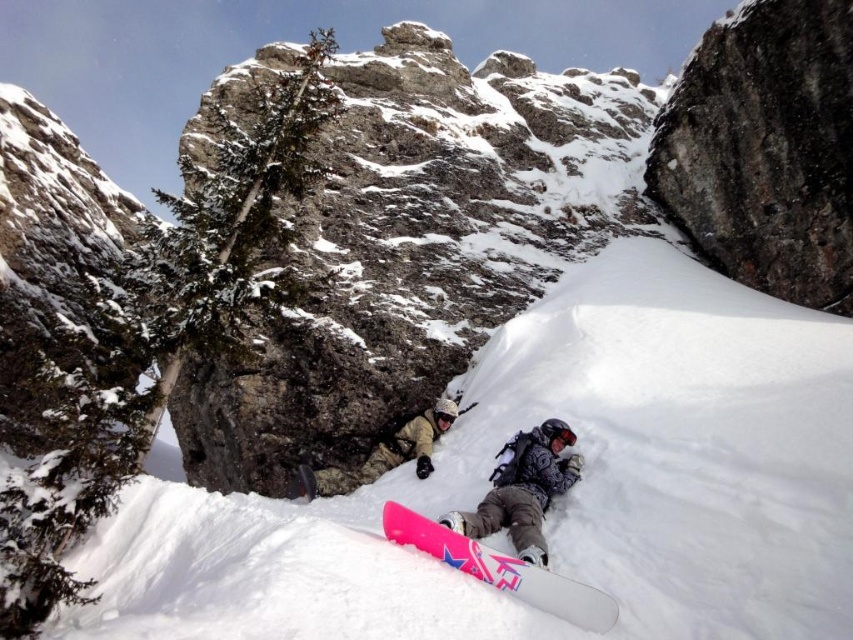
Question: Is matte black snowboard at lower center smaller than camouflage fabric person at center?

Choices:
 (A) no
 (B) yes

Answer: (B)

Question: Which object appears closest to the camera in this image?

Choices:
 (A) matte black snowboard at lower center
 (B) camouflage fabric person at center
 (C) pink matte snowboard at lower center

Answer: (C)

Question: Among these points, which one is nearest to the camera?

Choices:
 (A) (396, 516)
 (B) (544, 461)

Answer: (A)

Question: Can you confirm if matte black snowboard at lower center is positioned to the left of camouflage fabric person at center?

Choices:
 (A) yes
 (B) no

Answer: (B)

Question: In this image, where is matte black snowboard at lower center located relative to camouflage fabric person at center?

Choices:
 (A) right
 (B) left

Answer: (A)

Question: Which point is farther from the camera taking this photo?

Choices:
 (A) (608, 625)
 (B) (312, 486)
 (C) (527, 532)

Answer: (B)